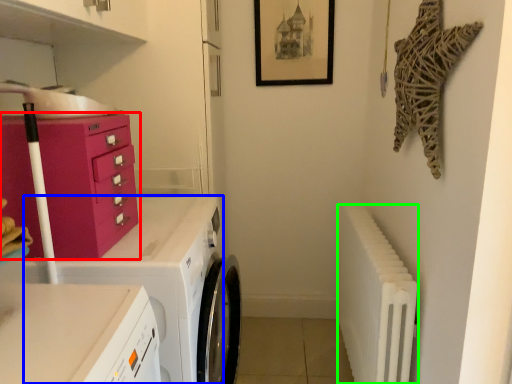
Question: Which object is positioned closest to chest of drawers (highlighted by a red box)? Select from home appliance (highlighted by a blue box) and radiator (highlighted by a green box).

Choices:
 (A) home appliance
 (B) radiator

Answer: (A)